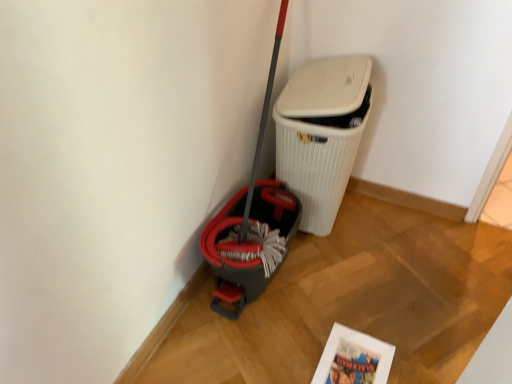
In order to click on free spot behind matte white comic book at lower center in this screenshot , I will do [x=340, y=312].